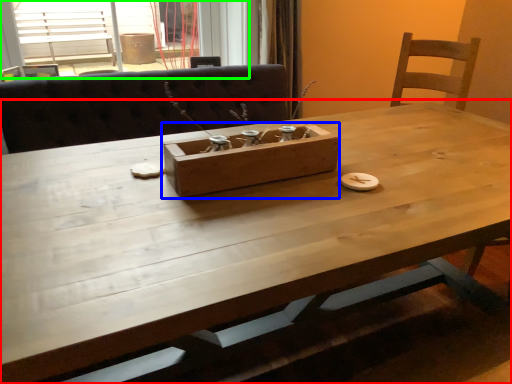
Question: Which is farther away from table (highlighted by a red box)? cardboard box (highlighted by a blue box) or window (highlighted by a green box)?

Choices:
 (A) cardboard box
 (B) window

Answer: (B)